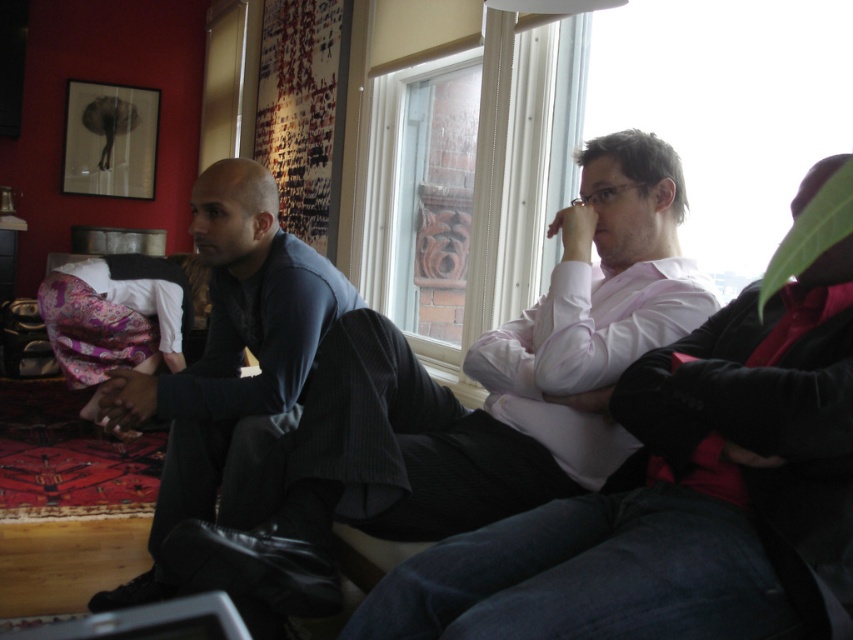
You are standing in the room and want to place a small potted plant at the point marked as point (589, 172). If the plant requires a minimum of 1.5 meters of space from the camera to ensure proper growth, will this location be suitable?

The distance of point (589, 172) from the camera is 1.73 meters, which is more than the required 1.5 meters. Therefore, placing the plant at this location will provide sufficient space for its growth.

You are a fashion designer observing the image. You need to determine which dark blue garment is shorter between the dark blue sweater at center and the dark blue shirt at left. Which one is shorter?

The dark blue sweater at center is shorter than the dark blue shirt at left.

From the picture: In the scene, there are a dark blue sweater at center and a clear glass window at center. Which object is smaller in size?

The dark blue sweater at center is smaller in size compared to the clear glass window at center.